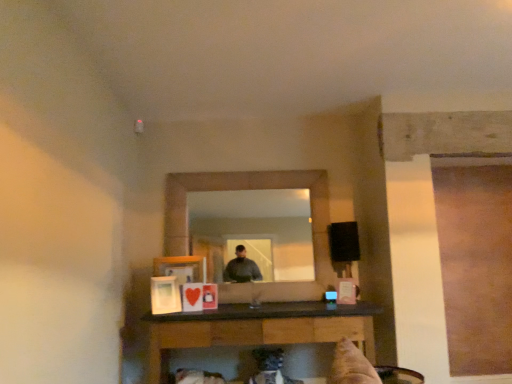
What do you see at coordinates (258, 328) in the screenshot? I see `black glossy table at lower center` at bounding box center [258, 328].

At what (x,y) coordinates should I click in order to perform the action: click on black glossy table at lower center. Please return your answer as a coordinate pair (x, y). Image resolution: width=512 pixels, height=384 pixels. Looking at the image, I should click on (258, 328).

In order to face black glossy table at lower center, should I rotate leftwards or rightwards?

It's best to rotate right around 1.018 degrees.

Locate an element on the screen. matte wooden mirror at center is located at coordinates (258, 228).

What is the approximate height of matte wooden mirror at center?

The height of matte wooden mirror at center is 1.04 meters.

Describe the element at coordinates (258, 228) in the screenshot. I see `matte wooden mirror at center` at that location.

This screenshot has height=384, width=512. Identify the location of black glossy table at lower center. (258, 328).

In the scene shown: Visually, is black glossy table at lower center positioned to the left or to the right of matte wooden mirror at center?

Clearly, black glossy table at lower center is on the right of matte wooden mirror at center in the image.

Considering the positions of objects black glossy table at lower center and matte wooden mirror at center in the image provided, who is behind, black glossy table at lower center or matte wooden mirror at center?

matte wooden mirror at center is further from the camera.

Is point (189, 318) farther from camera compared to point (302, 200)?

No.

From the image's perspective, between black glossy table at lower center and matte wooden mirror at center, which one is located above?

matte wooden mirror at center, from the image's perspective.

Based on the photo, from a real-world perspective, is black glossy table at lower center positioned above or below matte wooden mirror at center?

In terms of real-world spatial position, black glossy table at lower center is below matte wooden mirror at center.

In terms of width, does black glossy table at lower center look wider or thinner when compared to matte wooden mirror at center?

Clearly, black glossy table at lower center has more width compared to matte wooden mirror at center.

Which of these two, black glossy table at lower center or matte wooden mirror at center, stands taller?

With more height is matte wooden mirror at center.

Does black glossy table at lower center have a larger size compared to matte wooden mirror at center?

Indeed, black glossy table at lower center has a larger size compared to matte wooden mirror at center.

Choose the correct answer: Is black glossy table at lower center inside matte wooden mirror at center or outside it?

black glossy table at lower center is located beyond the bounds of matte wooden mirror at center.

Is black glossy table at lower center not close to matte wooden mirror at center?

Yes, black glossy table at lower center and matte wooden mirror at center are located far from each other.

Is black glossy table at lower center facing towards matte wooden mirror at center?

No, black glossy table at lower center is not facing towards matte wooden mirror at center.

Where is `table that appears on the right of matte wooden mirror at center`? The height and width of the screenshot is (384, 512). table that appears on the right of matte wooden mirror at center is located at coordinates (258, 328).

Does matte wooden mirror at center appear on the left side of black glossy table at lower center?

Indeed, matte wooden mirror at center is positioned on the left side of black glossy table at lower center.

Is matte wooden mirror at center in front of or behind black glossy table at lower center in the image?

Clearly, matte wooden mirror at center is behind black glossy table at lower center.

Which is behind, point (207, 217) or point (267, 326)?

Positioned behind is point (207, 217).

From the image's perspective, which one is positioned higher, matte wooden mirror at center or black glossy table at lower center?

matte wooden mirror at center.

From a real-world perspective, between matte wooden mirror at center and black glossy table at lower center, who is vertically lower?

black glossy table at lower center.

Does matte wooden mirror at center have a lesser width compared to black glossy table at lower center?

Yes, matte wooden mirror at center is thinner than black glossy table at lower center.

In terms of height, does matte wooden mirror at center look taller or shorter compared to black glossy table at lower center?

Considering their sizes, matte wooden mirror at center has more height than black glossy table at lower center.

Considering the relative sizes of matte wooden mirror at center and black glossy table at lower center in the image provided, is matte wooden mirror at center bigger than black glossy table at lower center?

No, matte wooden mirror at center is not bigger than black glossy table at lower center.

Can black glossy table at lower center be found inside matte wooden mirror at center?

That's incorrect, black glossy table at lower center is not inside matte wooden mirror at center.

Is matte wooden mirror at center next to black glossy table at lower center and touching it?

No, matte wooden mirror at center is not next to black glossy table at lower center.

Is matte wooden mirror at center oriented towards black glossy table at lower center?

No, matte wooden mirror at center does not turn towards black glossy table at lower center.

How different are the orientations of matte wooden mirror at center and black glossy table at lower center in degrees?

matte wooden mirror at center and black glossy table at lower center are facing 1.32 degrees away from each other.

There is a black glossy table at lower center. In order to click on mirror above it (from a real-world perspective) in this screenshot , I will do `click(258, 228)`.

Where is `mirror above the black glossy table at lower center (from a real-world perspective)`? mirror above the black glossy table at lower center (from a real-world perspective) is located at coordinates (258, 228).

The width and height of the screenshot is (512, 384). In order to click on table in front of the matte wooden mirror at center in this screenshot , I will do `click(258, 328)`.